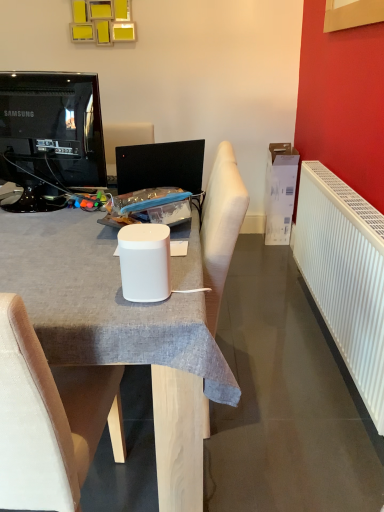
This screenshot has height=512, width=384. Identify the location of vacant area that lies to the right of white matte speaker at center. (185, 290).